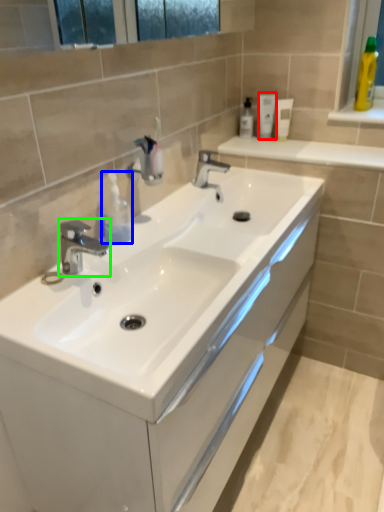
Question: Based on their relative distances, which object is nearer to mouthwash (highlighted by a red box)? Choose from toiletry (highlighted by a blue box) and tap (highlighted by a green box).

Choices:
 (A) toiletry
 (B) tap

Answer: (A)